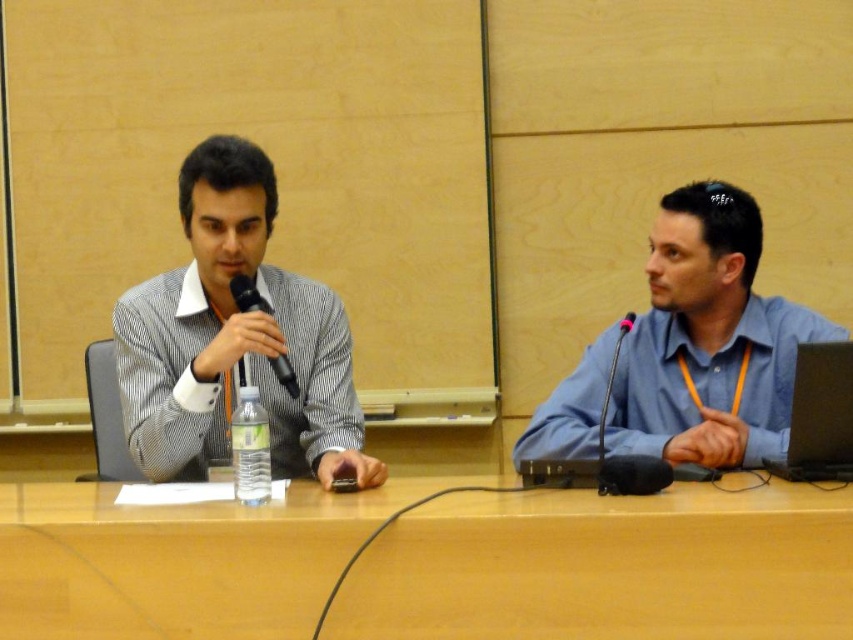
You are organizing a presentation and need to place a 15 cm tall document holder on the table. The wooden at center and black matte microphone at left are already there. Where should you place the document holder so it doesn

The wooden at center has a lesser height compared to the black matte microphone at left, so placing the document holder next to the wooden at center would provide enough space since the microphone is taller and might block the view if placed nearby.

In the scene shown: You are organizing a small event and need to place a 12 inch wide decorative item between the wooden at center and the striped fabric shirt at left. Will there be enough space?

The wooden at center and striped fabric shirt at left are 14.34 inches apart from each other. Since the decorative item is 12 inches wide, there is enough space to place it between them as 12 is less than 14.34.

You are organizing a small event and need to place a decorative centerpiece on the table between the wooden at center and the striped fabric shirt at left. Considering their sizes, which object should you place the centerpiece closer to?

The wooden at center is bigger than the striped fabric shirt at left, so the centerpiece should be placed closer to the wooden at center to maintain balance.